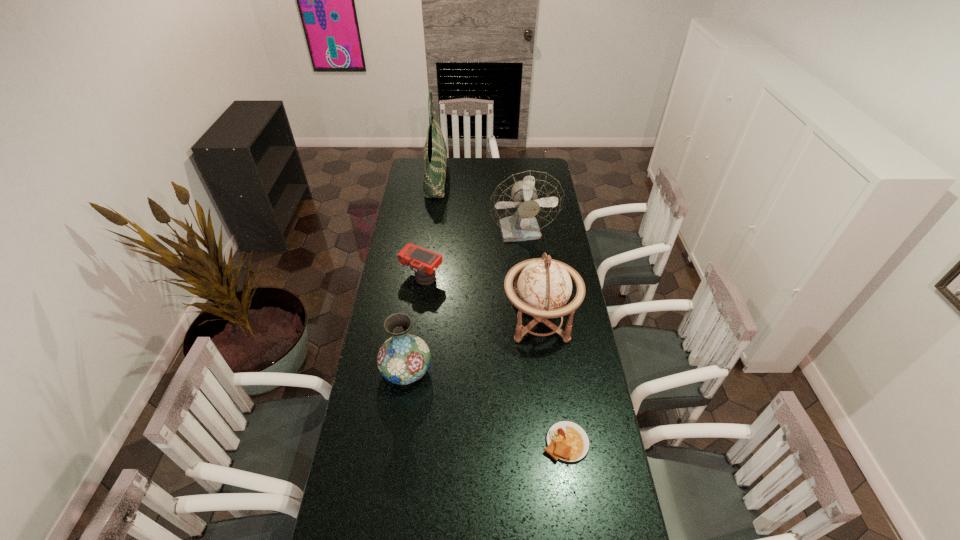
This screenshot has width=960, height=540. What are the coordinates of `object identified as the third closest to the third shortest object` in the screenshot? It's located at (566, 441).